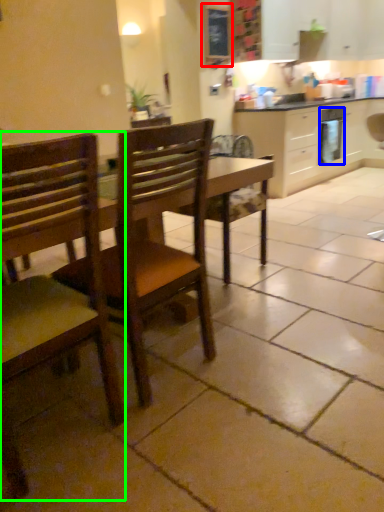
Question: Which object is positioned closest to bulletin board (highlighted by a red box)? Select from appliance (highlighted by a blue box) and chair (highlighted by a green box).

Choices:
 (A) appliance
 (B) chair

Answer: (A)